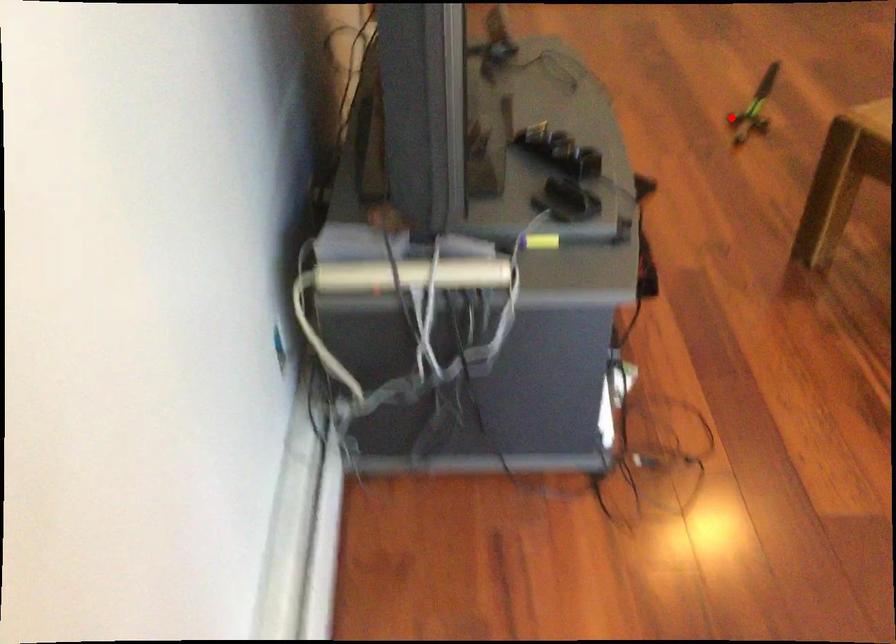
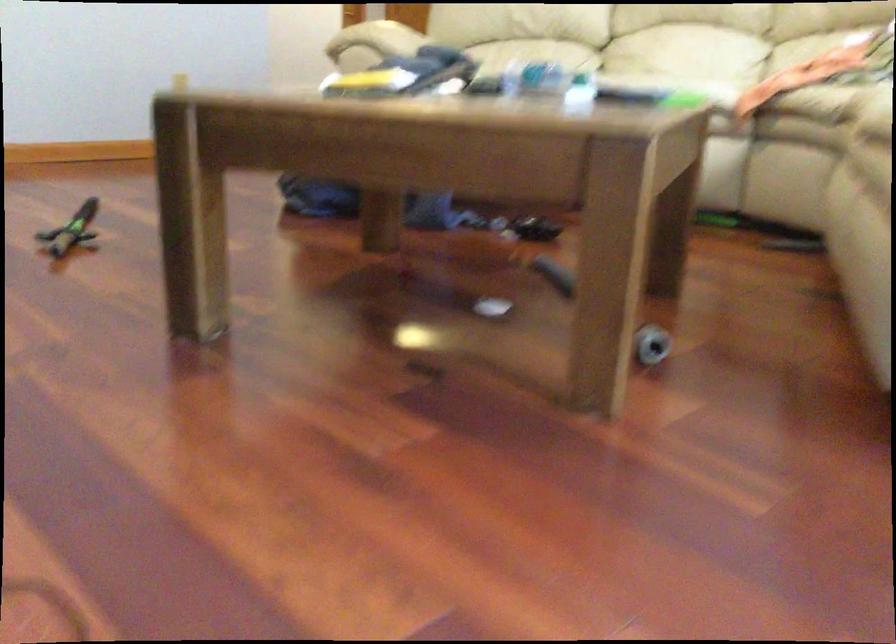
Find the pixel in the second image that matches the highlighted location in the first image.

(71, 230)